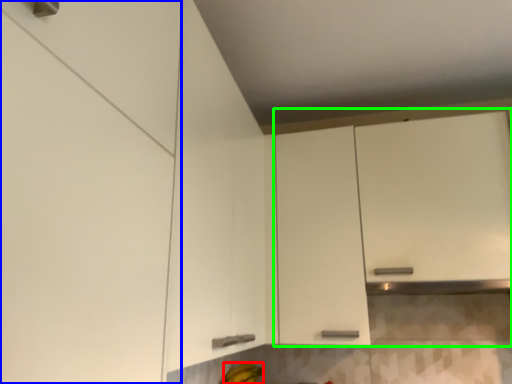
Question: Which is farther away from banana (highlighted by a red box)? cabinetry (highlighted by a blue box) or cabinetry (highlighted by a green box)?

Choices:
 (A) cabinetry
 (B) cabinetry

Answer: (A)